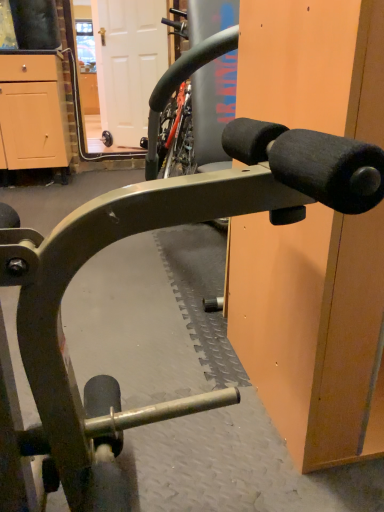
Question: From the image's perspective, is light wood cabinet at left above white matte door at upper center?

Choices:
 (A) no
 (B) yes

Answer: (A)

Question: From a real-world perspective, does light wood cabinet at left sit lower than white matte door at upper center?

Choices:
 (A) no
 (B) yes

Answer: (B)

Question: Considering the relative sizes of light wood cabinet at left and white matte door at upper center in the image provided, is light wood cabinet at left shorter than white matte door at upper center?

Choices:
 (A) yes
 (B) no

Answer: (A)

Question: From a real-world perspective, does light wood cabinet at left stand above white matte door at upper center?

Choices:
 (A) no
 (B) yes

Answer: (A)

Question: Does light wood cabinet at left have a smaller size compared to white matte door at upper center?

Choices:
 (A) no
 (B) yes

Answer: (A)

Question: Is light wood cabinet at left not within white matte door at upper center?

Choices:
 (A) no
 (B) yes

Answer: (B)

Question: Is white matte door at upper center taller than light wood cabinet at left?

Choices:
 (A) yes
 (B) no

Answer: (A)

Question: Considering the relative sizes of white matte door at upper center and light wood cabinet at left in the image provided, is white matte door at upper center wider than light wood cabinet at left?

Choices:
 (A) yes
 (B) no

Answer: (B)

Question: Is light wood cabinet at left a part of white matte door at upper center?

Choices:
 (A) yes
 (B) no

Answer: (B)

Question: From a real-world perspective, is white matte door at upper center over light wood cabinet at left?

Choices:
 (A) no
 (B) yes

Answer: (B)

Question: From a real-world perspective, does white matte door at upper center sit lower than light wood cabinet at left?

Choices:
 (A) no
 (B) yes

Answer: (A)

Question: Is white matte door at upper center bigger than light wood cabinet at left?

Choices:
 (A) yes
 (B) no

Answer: (B)

Question: Is point (1, 62) positioned closer to the camera than point (135, 112)?

Choices:
 (A) closer
 (B) farther

Answer: (A)